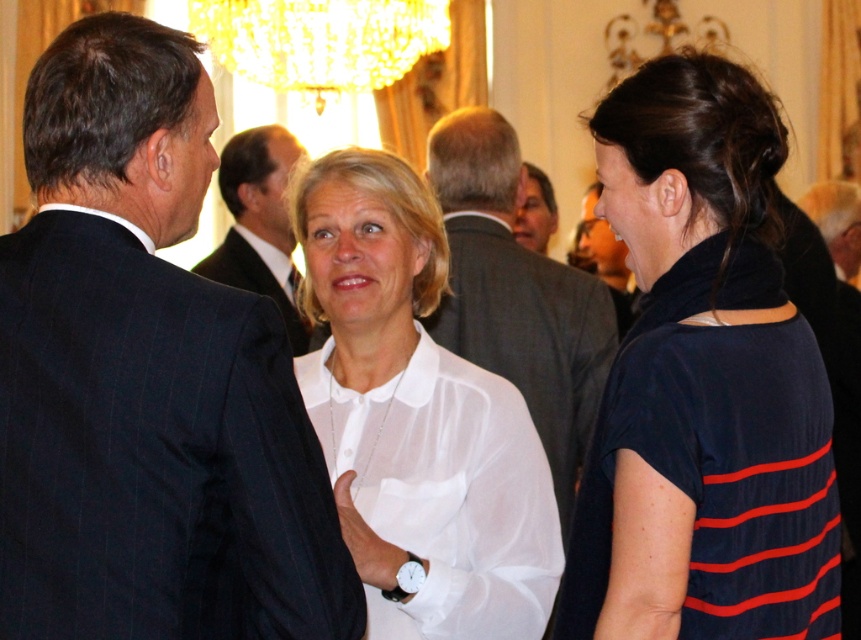
What are the coordinates of the dark blue pinstripe suit at center?

The dark blue pinstripe suit at center is located at coordinates point (147, 380).

You are a photographer at this event and want to ensure both the white sheer blouse at center and the gray suit jacket at center are clearly visible in your photo. Since the camera can only focus on one subject at a time, which one should you choose to focus on to ensure the other is also in focus?

The white sheer blouse at center is smaller than the gray suit jacket at center. To ensure both are in focus, focus on the gray suit jacket at center since it is larger and will have a greater depth of field, making it easier to include the smaller white sheer blouse at center within the focused area.